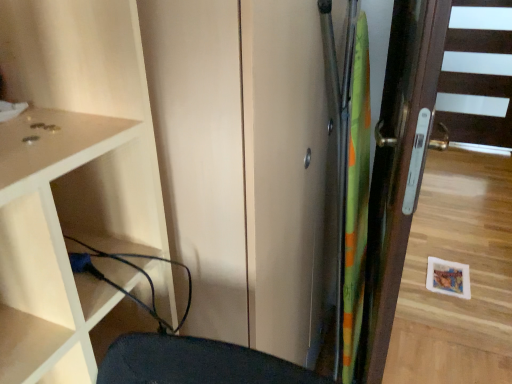
At what (x,y) coordinates should I click in order to perform the action: click on black rubber cable at lower left. Please return your answer as a coordinate pair (x, y). Looking at the image, I should click on (133, 268).

At what (x,y) coordinates should I click in order to perform the action: click on brown wooden door at right. Please return your answer as a coordinate pair (x, y). Looking at the image, I should click on (440, 192).

From a real-world perspective, is matte white cupboard at left positioned under green fabric screen door at right based on gravity?

Actually, matte white cupboard at left is physically above green fabric screen door at right in the real world.

Which is in front, point (22, 187) or point (163, 87)?

Point (22, 187)

From the image's perspective, would you say matte white cupboard at left is shown under green fabric screen door at right?

Yes.

Would you say matte white cupboard at left contains black rubber cable at lower left?

Yes, matte white cupboard at left contains black rubber cable at lower left.

Does matte white cupboard at left have a greater width compared to black rubber cable at lower left?

Indeed, matte white cupboard at left has a greater width compared to black rubber cable at lower left.

Find the location of `cable directly beneath the matte white cupboard at left (from a real-world perspective)`. cable directly beneath the matte white cupboard at left (from a real-world perspective) is located at coordinates (133, 268).

Can you confirm if green fabric screen door at right is thinner than black rubber cable at lower left?

Incorrect, the width of green fabric screen door at right is not less than that of black rubber cable at lower left.

Is green fabric screen door at right looking in the opposite direction of black rubber cable at lower left?

No, green fabric screen door at right is not facing the opposite direction of black rubber cable at lower left.

Is the surface of green fabric screen door at right in direct contact with black rubber cable at lower left?

No, green fabric screen door at right is not touching black rubber cable at lower left.

Is point (313, 103) positioned behind point (152, 281)?

Yes, point (313, 103) is behind point (152, 281).

Which of these two, green fabric screen door at right or brown wooden door at right, is thinner?

brown wooden door at right is thinner.

In order to click on screen door positioned vertically above the brown wooden door at right (from a real-world perspective) in this screenshot , I will do `click(246, 165)`.

Looking at this image, how many degrees apart are the facing directions of green fabric screen door at right and brown wooden door at right?

There is a 88-degree angle between the facing directions of green fabric screen door at right and brown wooden door at right.

From the image's perspective, is green fabric screen door at right located above or below brown wooden door at right?

From the image's perspective, green fabric screen door at right appears below brown wooden door at right.

Does brown wooden door at right contain green fabric screen door at right?

Definitely not — green fabric screen door at right is not inside brown wooden door at right.

Is brown wooden door at right facing away from green fabric screen door at right?

No.

Relative to green fabric screen door at right, is brown wooden door at right in front or behind?

Clearly, brown wooden door at right is behind green fabric screen door at right.

From a real-world perspective, is brown wooden door at right beneath black rubber cable at lower left?

Yes.

Does point (417, 287) appear closer or farther from the camera than point (136, 302)?

Clearly, point (417, 287) is more distant from the camera than point (136, 302).

Considering the sizes of objects brown wooden door at right and black rubber cable at lower left in the image provided, who is shorter, brown wooden door at right or black rubber cable at lower left?

black rubber cable at lower left is shorter.

Is brown wooden door at right outside of black rubber cable at lower left?

brown wooden door at right is positioned outside black rubber cable at lower left.

In the scene shown: Considering the relative sizes of black rubber cable at lower left and green fabric screen door at right in the image provided, is black rubber cable at lower left bigger than green fabric screen door at right?

Actually, black rubber cable at lower left might be smaller than green fabric screen door at right.

In the scene shown: Is black rubber cable at lower left in front of or behind green fabric screen door at right in the image?

black rubber cable at lower left is positioned farther from the viewer than green fabric screen door at right.

Is black rubber cable at lower left oriented away from green fabric screen door at right?

black rubber cable at lower left is not turned away from green fabric screen door at right.

Find the location of a particular element. This screenshot has width=512, height=384. cupboard in front of the green fabric screen door at right is located at coordinates (71, 177).

Locate an element on the screen. cable below the matte white cupboard at left (from a real-world perspective) is located at coordinates (133, 268).

Considering their positions, is green fabric screen door at right positioned further to black rubber cable at lower left than matte white cupboard at left?

green fabric screen door at right.

From the picture: Which object lies nearer to the anchor point brown wooden door at right, green fabric screen door at right or black rubber cable at lower left?

The object closer to brown wooden door at right is green fabric screen door at right.

Considering their positions, is matte white cupboard at left positioned closer to brown wooden door at right than green fabric screen door at right?

The object closer to brown wooden door at right is green fabric screen door at right.

Which object lies further to the anchor point green fabric screen door at right, matte white cupboard at left or brown wooden door at right?

brown wooden door at right is positioned further to the anchor green fabric screen door at right.

Which object lies nearer to the anchor point black rubber cable at lower left, brown wooden door at right or green fabric screen door at right?

green fabric screen door at right lies closer to black rubber cable at lower left than the other object.

When comparing their distances from black rubber cable at lower left, does green fabric screen door at right or brown wooden door at right seem closer?

green fabric screen door at right.

Considering their positions, is matte white cupboard at left positioned closer to black rubber cable at lower left than green fabric screen door at right?

Among the two, matte white cupboard at left is located nearer to black rubber cable at lower left.

Based on their spatial positions, is black rubber cable at lower left or green fabric screen door at right further from matte white cupboard at left?

green fabric screen door at right.

You are a GUI agent. You are given a task and a screenshot of the screen. Output one action in this format:
    pyautogui.click(x=<x>, y=<y>)
    Task: Click on the cable between matte white cupboard at left and brown wooden door at right from left to right
    Image resolution: width=512 pixels, height=384 pixels.
    Given the screenshot: What is the action you would take?
    pyautogui.click(x=133, y=268)

At what (x,y) coordinates should I click in order to perform the action: click on screen door situated between black rubber cable at lower left and brown wooden door at right from left to right. Please return your answer as a coordinate pair (x, y). The image size is (512, 384). Looking at the image, I should click on (246, 165).

The height and width of the screenshot is (384, 512). Identify the location of screen door between matte white cupboard at left and brown wooden door at right from left to right. (246, 165).

Find the location of a particular element. screen door located between matte white cupboard at left and black rubber cable at lower left in the depth direction is located at coordinates (246, 165).